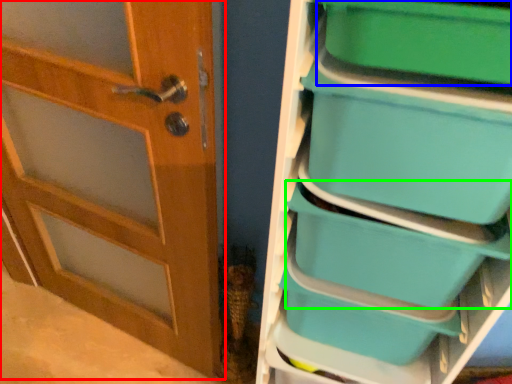
Question: Which object is positioned farthest from door (highlighted by a red box)? Select from storage box (highlighted by a blue box) and storage box (highlighted by a green box).

Choices:
 (A) storage box
 (B) storage box

Answer: (A)